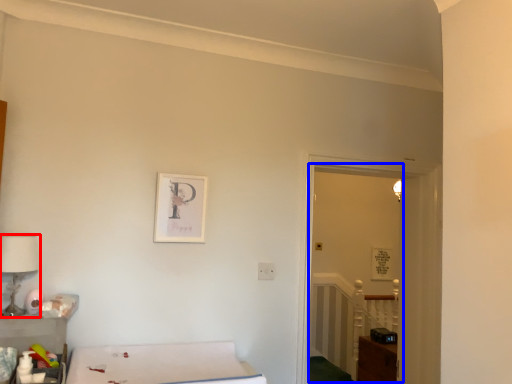
Question: Which object appears farthest to the camera in this image, table lamp (highlighted by a red box) or glass door (highlighted by a blue box)?

Choices:
 (A) table lamp
 (B) glass door

Answer: (B)